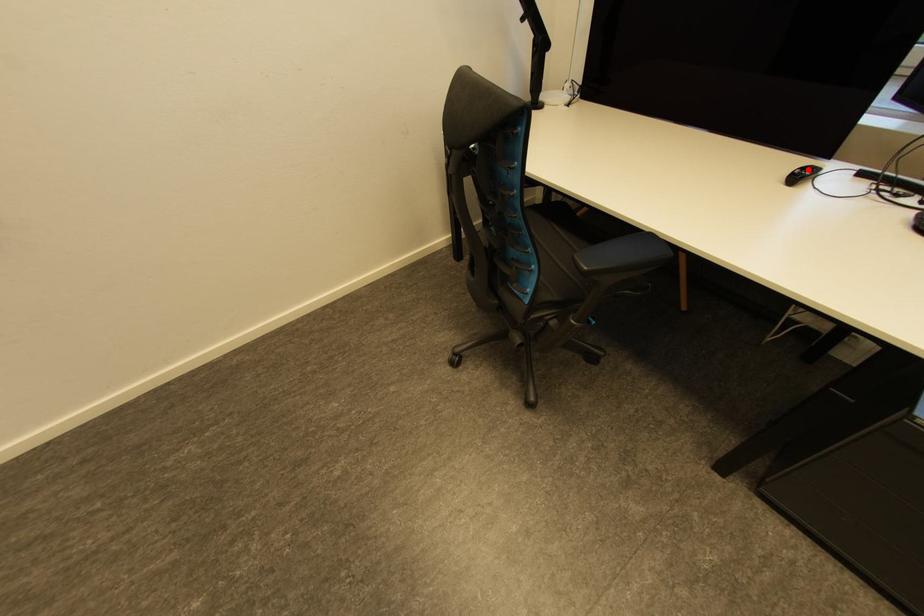
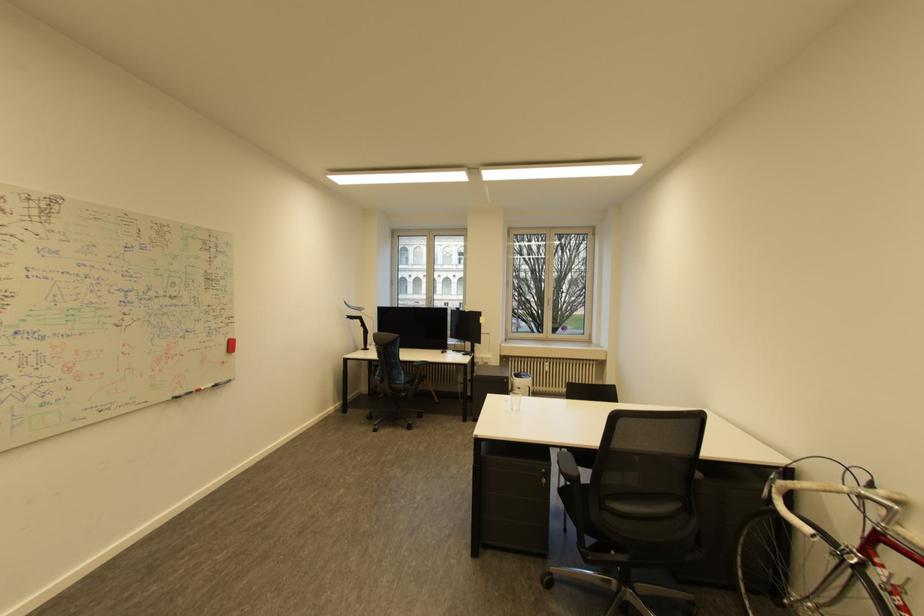
Question: I am providing you with two images of the same scene from different viewpoints. A red point is marked on the first image. At the location where the point appears in image 1, is it still visible in image 2?

Choices:
 (A) Yes
 (B) No

Answer: (B)